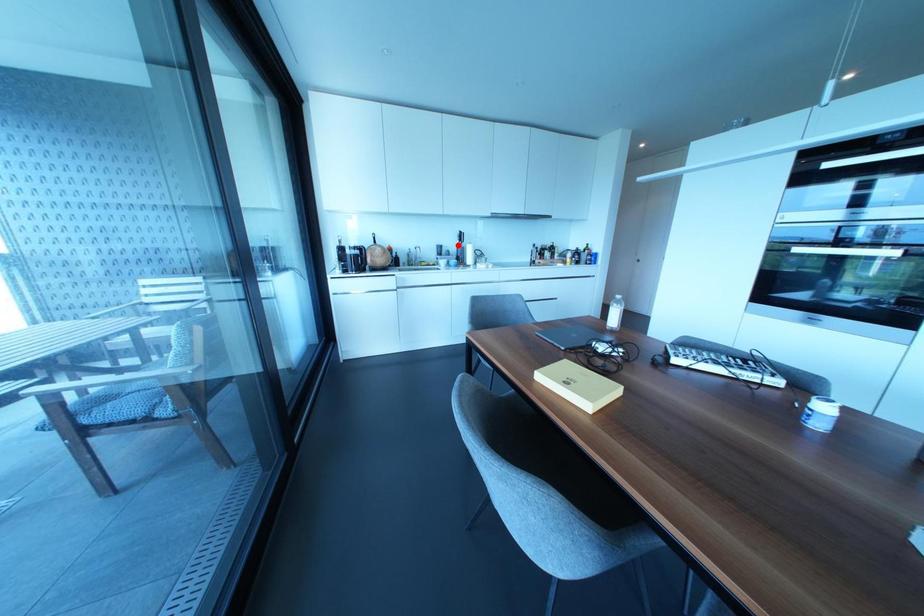
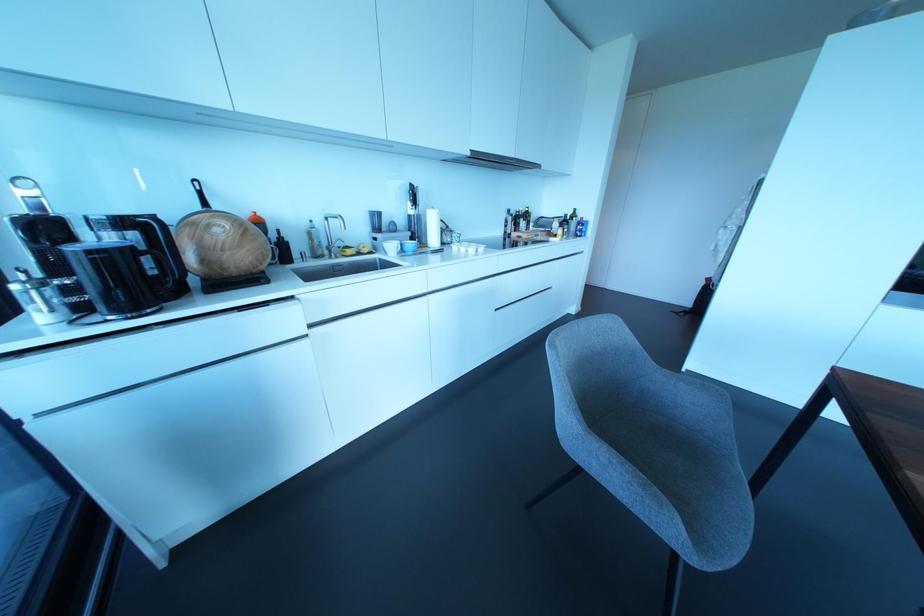
In the second image, find the point that corresponds to the highlighted location in the first image.

(410, 211)